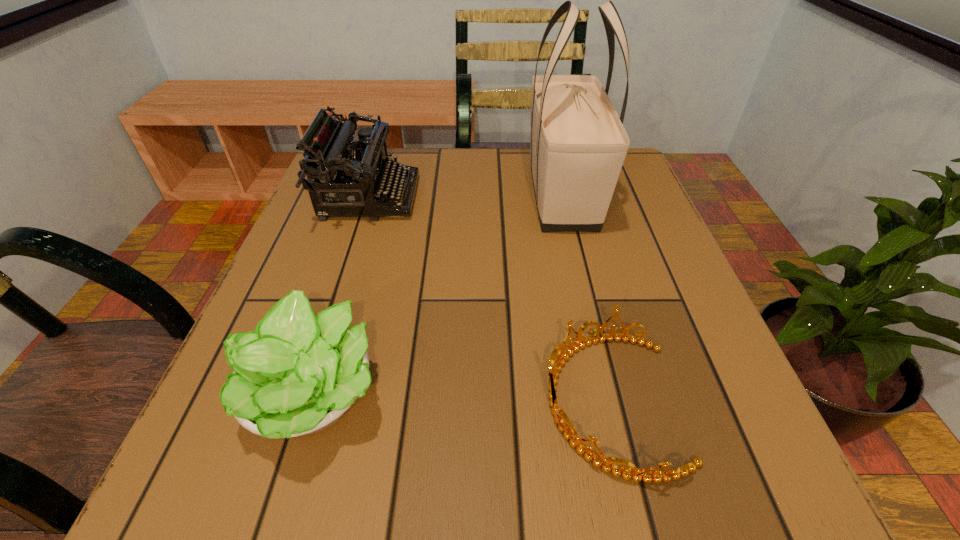
Locate an element on the screen. Image resolution: width=960 pixels, height=540 pixels. shopping bag is located at coordinates (578, 146).

This screenshot has width=960, height=540. What are the coordinates of `the second tallest object` in the screenshot? It's located at (365, 174).

Identify the location of lettuce. The width and height of the screenshot is (960, 540). (296, 374).

Where is `tiara`? This screenshot has width=960, height=540. tiara is located at coordinates (646, 475).

At what (x,y) coordinates should I click in order to perform the action: click on free point located with handles facing forward on the shopping bag. Please return your answer as a coordinate pair (x, y). The image size is (960, 540). Looking at the image, I should click on (593, 327).

This screenshot has height=540, width=960. I want to click on vacant space located 0.290m on the keyboard of the third shortest object, so click(547, 197).

Identify the location of vacant area situated on the right of the lettuce. [526, 394].

This screenshot has height=540, width=960. I want to click on vacant point located 0.400m on the front-facing side of the tiara, so click(x=253, y=401).

Where is `vacant space positioned on the front-facing side of the tiara`? vacant space positioned on the front-facing side of the tiara is located at coordinates (468, 401).

This screenshot has width=960, height=540. What are the coordinates of `free space located on the front-facing side of the tiara` in the screenshot? It's located at (412, 401).